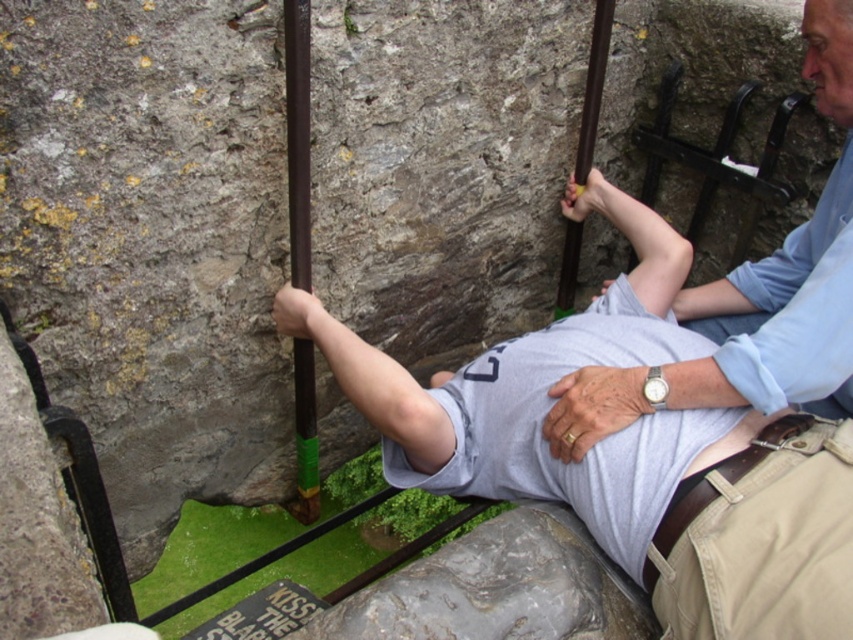
Question: Considering the real-world distances, which object is closest to the gray cotton shirt at center?

Choices:
 (A) brown polished pole at center
 (B) tan canvas pants at lower right

Answer: (B)

Question: Can you confirm if tan canvas pants at lower right is thinner than brown polished pole at center?

Choices:
 (A) yes
 (B) no

Answer: (B)

Question: Can you confirm if light blue cotton shirt at upper right is smaller than brown polished pole at center?

Choices:
 (A) no
 (B) yes

Answer: (A)

Question: Which point is closer to the camera?

Choices:
 (A) (851, 460)
 (B) (289, 104)
 (C) (804, 346)
 (D) (608, 458)

Answer: (C)

Question: Which object is the closest to the brown polished pole at center?

Choices:
 (A) light blue cotton shirt at upper right
 (B) green plastic pole at center

Answer: (A)

Question: Does green plastic pole at center have a greater width compared to brown polished pole at center?

Choices:
 (A) no
 (B) yes

Answer: (B)